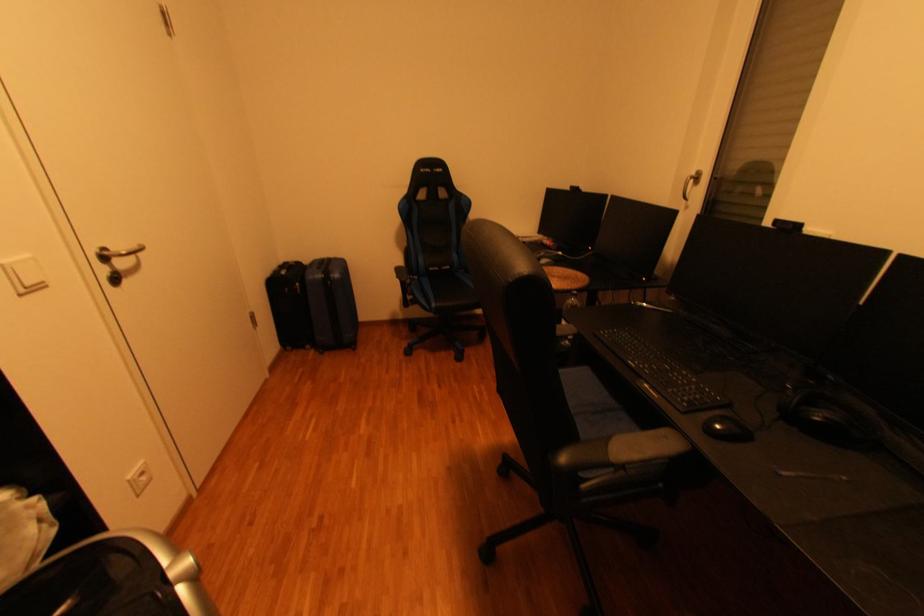
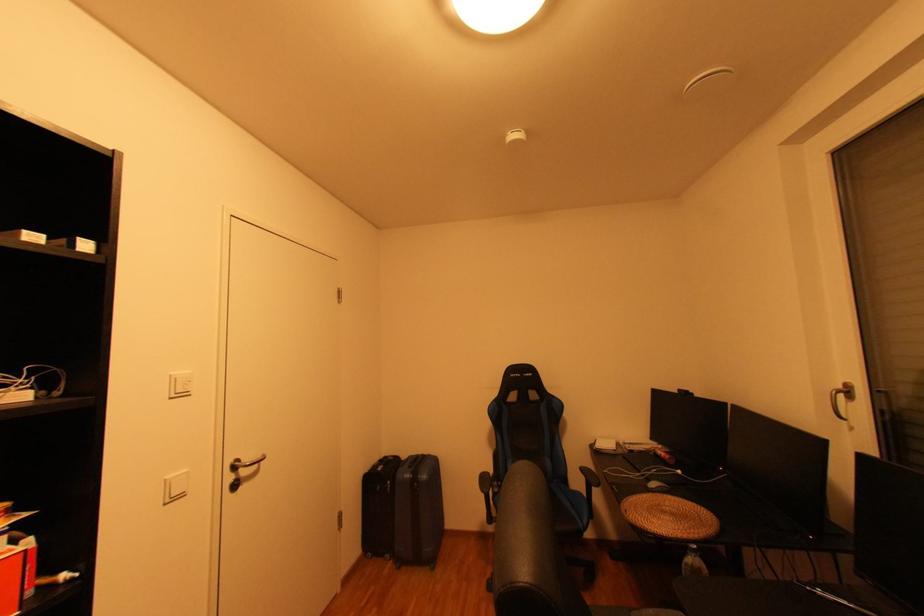
Locate, in the second image, the point that corresponds to point 704,176 in the first image.

(849, 387)